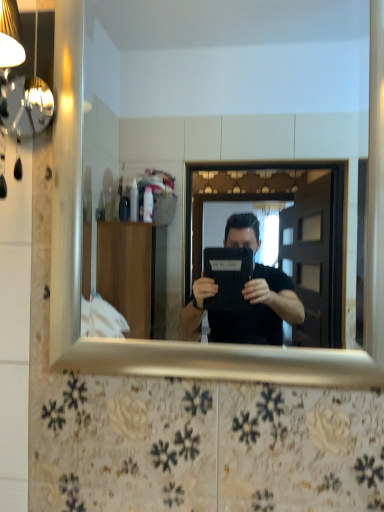
This screenshot has height=512, width=384. What do you see at coordinates (227, 92) in the screenshot?
I see `matte black tablet at center` at bounding box center [227, 92].

The width and height of the screenshot is (384, 512). Find the location of `matte black tablet at center`. matte black tablet at center is located at coordinates (227, 92).

Identify the location of matte black tablet at center. (227, 92).